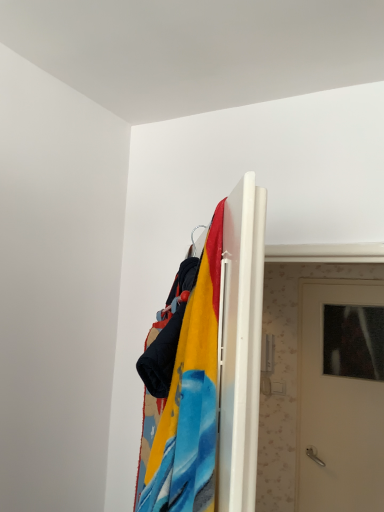
Question: Considering the positions of velvet fabric blanket at upper center and white matte door at center in the image, is velvet fabric blanket at upper center bigger or smaller than white matte door at center?

Choices:
 (A) small
 (B) big

Answer: (A)

Question: Considering the positions of point (251, 209) and point (317, 329), is point (251, 209) closer or farther from the camera than point (317, 329)?

Choices:
 (A) closer
 (B) farther

Answer: (A)

Question: Do you think velvet fabric blanket at upper center is within white matte door at center, or outside of it?

Choices:
 (A) inside
 (B) outside

Answer: (B)

Question: From the image's perspective, relative to velvet fabric blanket at upper center, is white matte door at center above or below?

Choices:
 (A) above
 (B) below

Answer: (B)

Question: Choose the correct answer: Is white matte door at center inside velvet fabric blanket at upper center or outside it?

Choices:
 (A) outside
 (B) inside

Answer: (A)

Question: Considering the positions of white matte door at center and velvet fabric blanket at upper center in the image, is white matte door at center bigger or smaller than velvet fabric blanket at upper center?

Choices:
 (A) big
 (B) small

Answer: (A)

Question: Considering the positions of white matte door at center and velvet fabric blanket at upper center in the image, is white matte door at center taller or shorter than velvet fabric blanket at upper center?

Choices:
 (A) short
 (B) tall

Answer: (B)